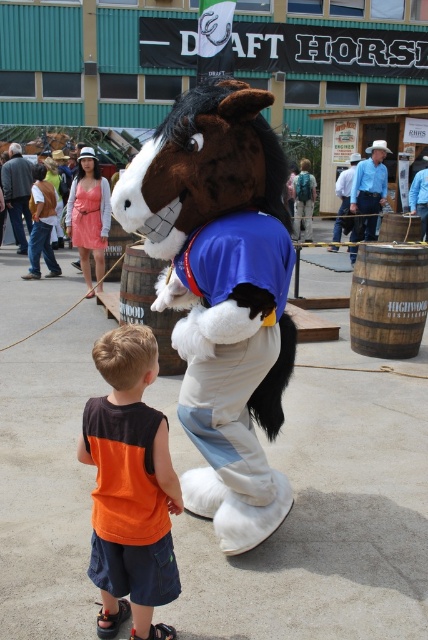
Question: Which of the following is the farthest from the observer?

Choices:
 (A) orange fabric shirt at lower left
 (B) brown plush horse at center

Answer: (B)

Question: Does brown plush horse at center have a greater width compared to orange fabric shirt at lower left?

Choices:
 (A) yes
 (B) no

Answer: (A)

Question: Is brown plush horse at center smaller than orange fabric shirt at lower left?

Choices:
 (A) no
 (B) yes

Answer: (A)

Question: Which point is closer to the camera?

Choices:
 (A) orange fabric shirt at lower left
 (B) brown plush horse at center

Answer: (A)

Question: Which of the following is the farthest from the observer?

Choices:
 (A) (166, 122)
 (B) (143, 333)

Answer: (A)

Question: Does brown plush horse at center have a larger size compared to orange fabric shirt at lower left?

Choices:
 (A) yes
 (B) no

Answer: (A)